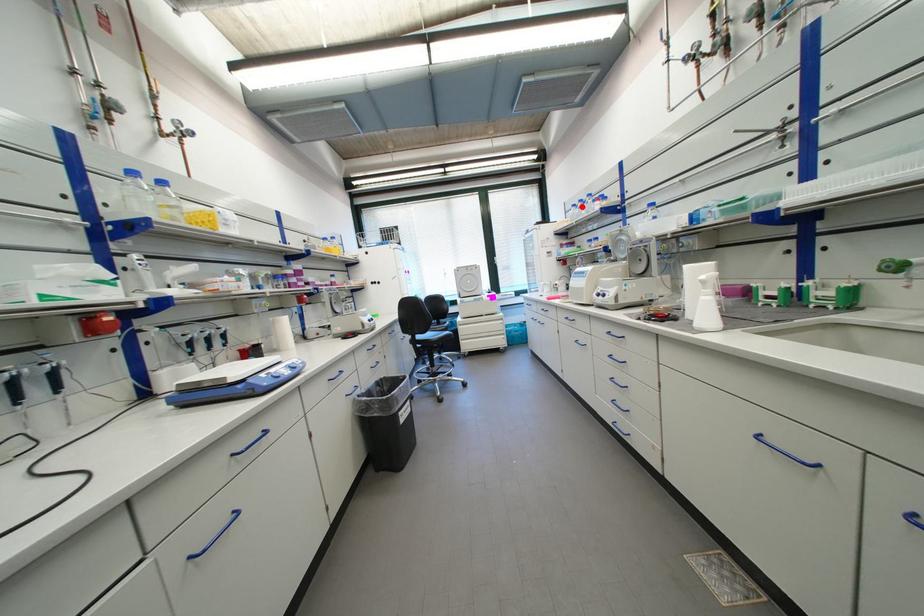
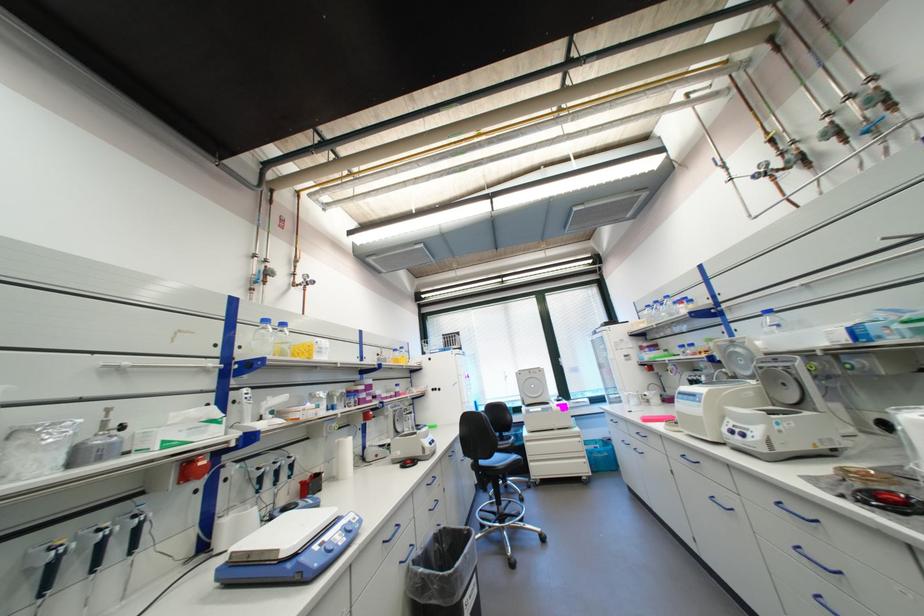
Question: I am providing you with two images of the same scene from different viewpoints. A red point is marked on the first image. Is the red point's position out of view in image 2?

Choices:
 (A) Yes
 (B) No

Answer: (B)